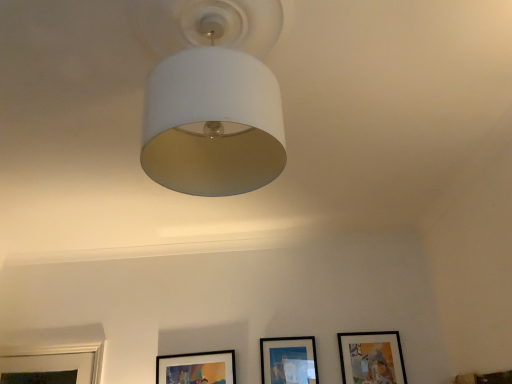
Question: From the image's perspective, is white matte lampshade at upper center positioned above or below matte black picture frame at lower right, positioned as the 3th picture frame in left-to-right order?

Choices:
 (A) above
 (B) below

Answer: (A)

Question: From a real-world perspective, is white matte lampshade at upper center physically located above or below matte black picture frame at lower right, which ranks as the first picture frame in right-to-left order?

Choices:
 (A) above
 (B) below

Answer: (A)

Question: Considering the real-world distances, which object is closest to the white matte lampshade at upper center?

Choices:
 (A) matte black picture frame at center, the 2th picture frame in the right-to-left sequence
 (B) matte black picture frame at lower center, marked as the 1th picture frame in a left-to-right arrangement
 (C) matte black picture frame at lower right, which ranks as the first picture frame in right-to-left order

Answer: (A)

Question: Estimate the real-world distances between objects in this image. Which object is closer to the matte black picture frame at lower center, which is counted as the 3th picture frame, starting from the right?

Choices:
 (A) matte black picture frame at lower right, which ranks as the first picture frame in right-to-left order
 (B) white matte lampshade at upper center
 (C) matte black picture frame at center, the 2th picture frame positioned from the left

Answer: (C)